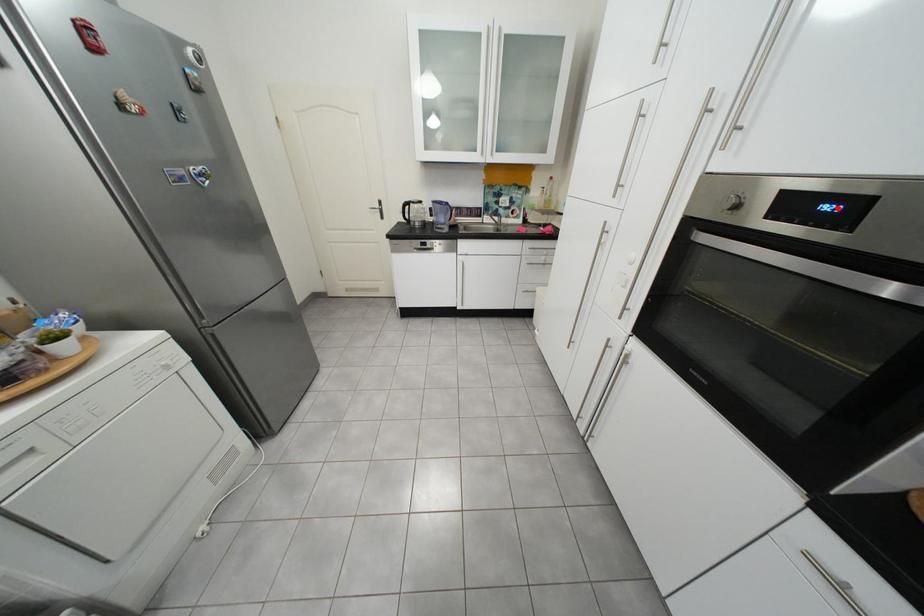
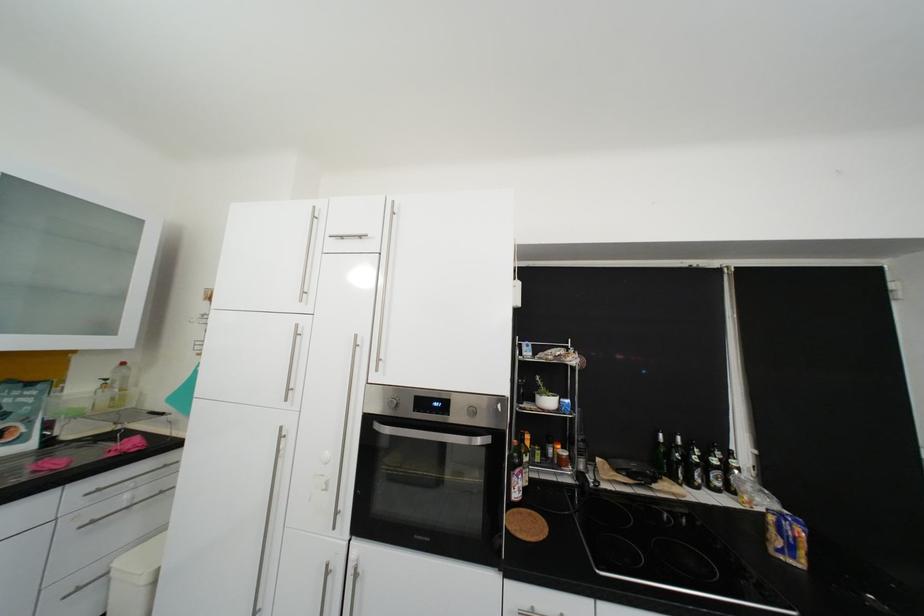
Locate, in the second image, the point that corresponds to the highlighted location in the first image.

(447, 406)